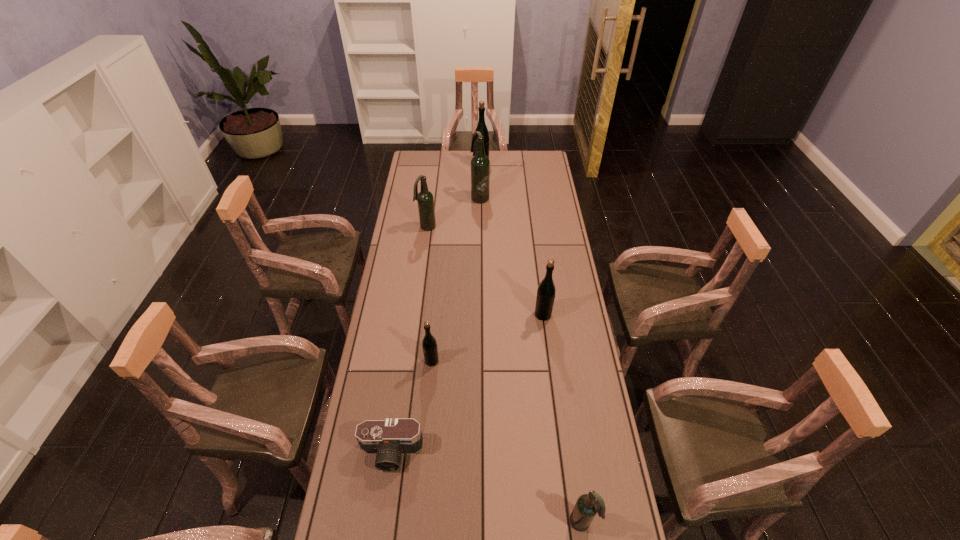
What are the coordinates of `the nearest beer bottle` in the screenshot? It's located at (586, 507).

I want to click on the smallest dark beer bottle, so click(x=586, y=507).

Find the location of `camera`. camera is located at coordinates (388, 439).

Identify the location of the second nearest object. (388, 439).

At what (x,y) coordinates should I click in order to perform the action: click on free location located on the right of the second green beer bottle from right to left. Please return your answer as a coordinate pair (x, y). This screenshot has height=540, width=960. Looking at the image, I should click on (510, 165).

Find the location of `vacant position located 0.070m on the front of the second dark beer bottle from right to left`. vacant position located 0.070m on the front of the second dark beer bottle from right to left is located at coordinates (480, 212).

Where is `vacant space located on the right of the second farthest dark beer bottle`? The image size is (960, 540). vacant space located on the right of the second farthest dark beer bottle is located at coordinates (514, 227).

Locate an element on the screen. The height and width of the screenshot is (540, 960). vacant point located on the left of the rightmost green beer bottle is located at coordinates (462, 314).

This screenshot has height=540, width=960. I want to click on free space located on the front of the second nearest beer bottle, so click(425, 437).

Image resolution: width=960 pixels, height=540 pixels. Find the location of `blank space located 0.090m on the right of the nearest object`. blank space located 0.090m on the right of the nearest object is located at coordinates (625, 522).